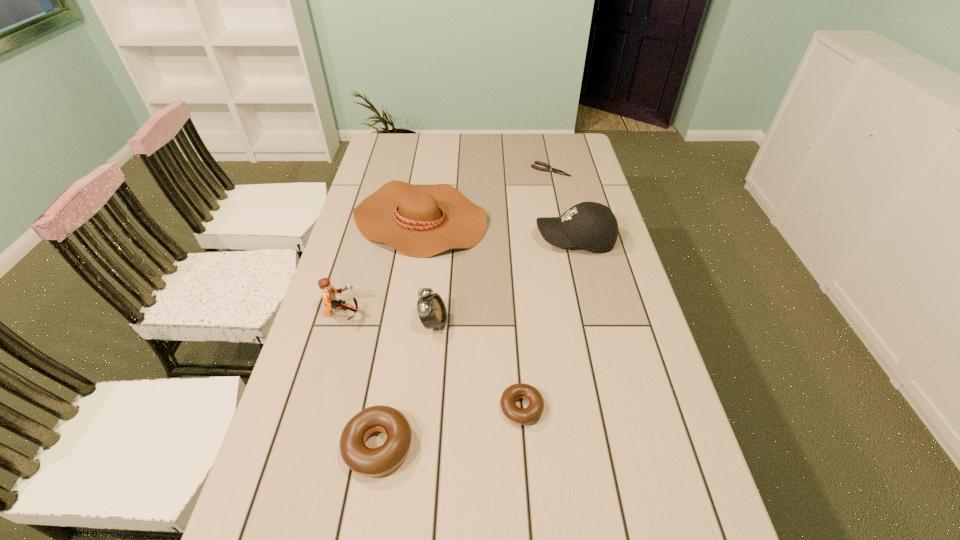
The image size is (960, 540). Identify the location of vacant area that lies between the third shortest object and the Lego. (361, 380).

You are a GUI agent. You are given a task and a screenshot of the screen. Output one action in this format:
    pyautogui.click(x=<x>, y=<y>)
    Task: Click on the closest object to the Lego
    
    Given the screenshot: What is the action you would take?
    pyautogui.click(x=431, y=309)

Point out which object is positioned as the second nearest to the alarm clock. Please provide its 2D coordinates. Your answer should be formatted as a tuple, i.e. [(x, y)], where the tuple contains the x and y coordinates of a point satisfying the conditions above.

[(522, 416)]

In order to click on free space that satisfies the following two spatial constraints: 1. on the face of the alarm clock; 2. on the left side of the right doughnut in this screenshot , I will do `click(425, 408)`.

Where is `free space in the image that satisfies the following two spatial constraints: 1. on the front-facing side of the baseball cap; 2. on the front side of the fifth object from left to right`? The image size is (960, 540). free space in the image that satisfies the following two spatial constraints: 1. on the front-facing side of the baseball cap; 2. on the front side of the fifth object from left to right is located at coordinates (614, 408).

Locate an element on the screen. The image size is (960, 540). vacant space that satisfies the following two spatial constraints: 1. on the front-facing side of the baseball cap; 2. on the front side of the left doughnut is located at coordinates (624, 446).

What are the coordinates of `vacant region that satisfies the following two spatial constraints: 1. on the back side of the right doughnut; 2. on the left side of the third shortest object` in the screenshot? It's located at (385, 408).

Where is `free space that satisfies the following two spatial constraints: 1. on the back side of the shorter doughnut; 2. on the face of the alarm clock`? The height and width of the screenshot is (540, 960). free space that satisfies the following two spatial constraints: 1. on the back side of the shorter doughnut; 2. on the face of the alarm clock is located at coordinates click(x=516, y=323).

Identify the location of vacant position in the image that satisfies the following two spatial constraints: 1. on the back side of the farthest object; 2. on the right side of the left doughnut. (424, 170).